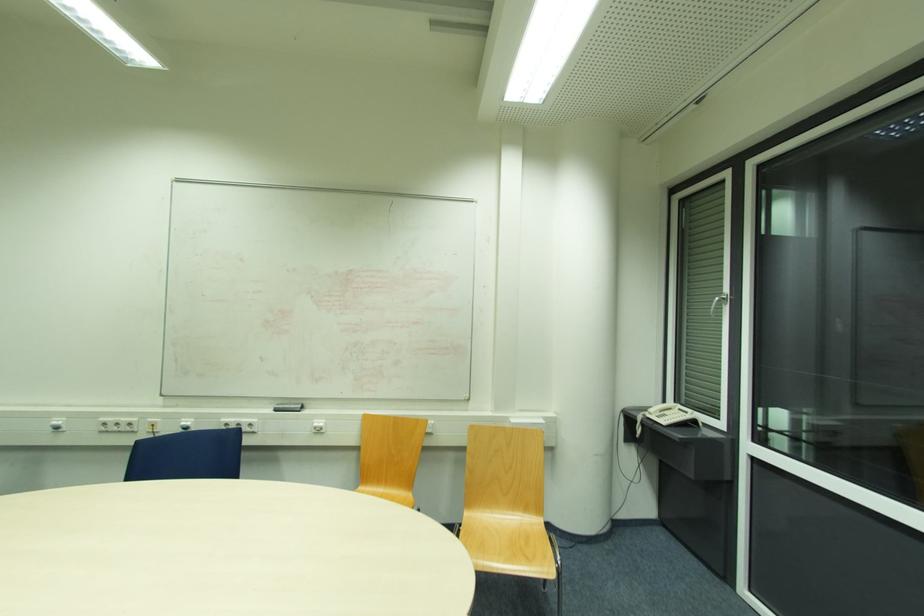
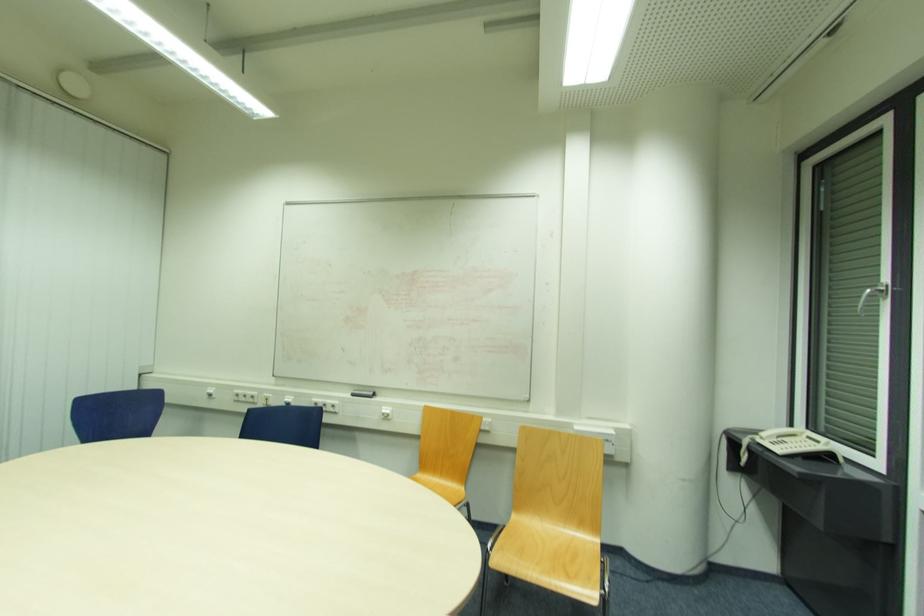
The point at [276,411] is marked in the first image. Where is the corresponding point in the second image?

(355, 395)